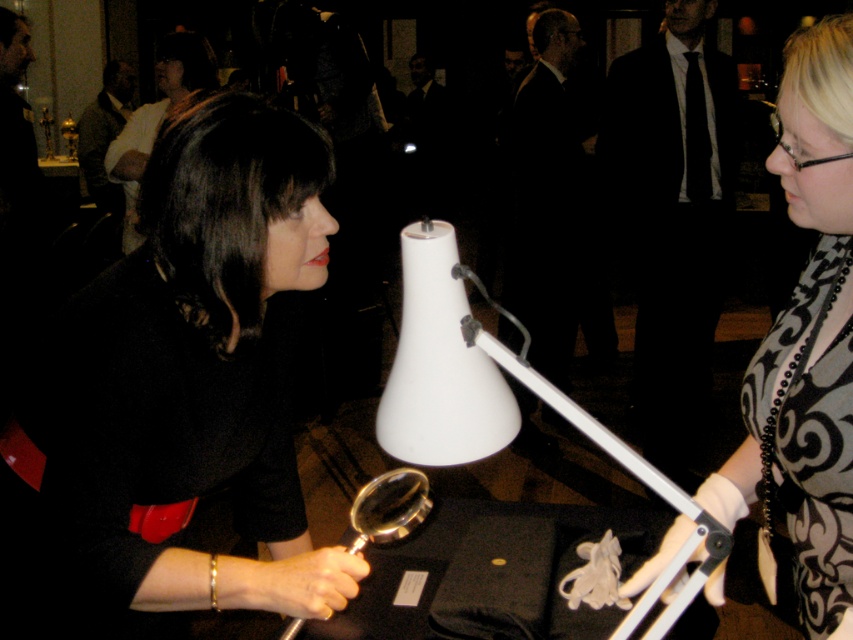
You are a GUI agent. You are given a task and a screenshot of the screen. Output one action in this format:
    pyautogui.click(x=<x>, y=<y>)
    Task: Click on the white plastic lamp at center
    The height and width of the screenshot is (640, 853).
    Given the screenshot: What is the action you would take?
    pyautogui.click(x=498, y=403)

Which is above, white plastic lamp at center or silver metallic magnifying glass at center?

white plastic lamp at center is higher up.

Between point (608, 454) and point (421, 515), which one is positioned behind?

Point (608, 454)

Locate an element on the screen. This screenshot has width=853, height=640. white plastic lamp at center is located at coordinates (498, 403).

Can you confirm if black matte dress at center is wider than matte black dress at center?

No, black matte dress at center is not wider than matte black dress at center.

Between black matte dress at center and matte black dress at center, which one appears on the left side from the viewer's perspective?

matte black dress at center

Does point (97, 413) come in front of point (135, 156)?

That is True.

Locate an element on the screen. Image resolution: width=853 pixels, height=640 pixels. black matte dress at center is located at coordinates (194, 376).

Does patterned fabric dress at center come in front of matte black dress at center?

Yes.

Between point (837, 632) and point (170, 36), which one is positioned in front?

Point (837, 632) is in front.

Is point (849, 84) positioned before point (160, 60)?

Yes, point (849, 84) is closer to viewer.

Locate an element on the screen. This screenshot has height=640, width=853. patterned fabric dress at center is located at coordinates (807, 340).